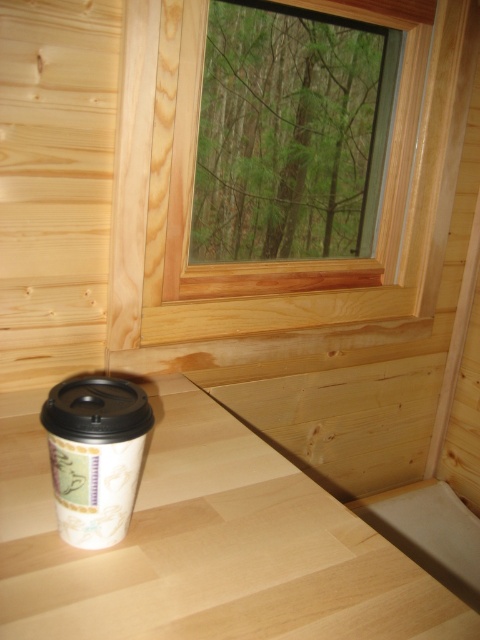
Question: Can you confirm if white wood table at lower center is positioned to the right of natural wood window at upper center?

Choices:
 (A) yes
 (B) no

Answer: (B)

Question: Can you confirm if white wood table at lower center is positioned to the right of white paper cup at lower left?

Choices:
 (A) no
 (B) yes

Answer: (B)

Question: In this image, where is natural wood window at upper center located relative to white paper cup at lower left?

Choices:
 (A) above
 (B) below

Answer: (A)

Question: Which object is the farthest from the natural wood window at upper center?

Choices:
 (A) white paper cup at lower left
 (B) white wood table at lower center

Answer: (A)

Question: Estimate the real-world distances between objects in this image. Which object is closer to the white wood table at lower center?

Choices:
 (A) white paper cup at lower left
 (B) natural wood window at upper center

Answer: (A)

Question: Which point is farther to the camera?

Choices:
 (A) natural wood window at upper center
 (B) white wood table at lower center
 (C) white paper cup at lower left

Answer: (A)